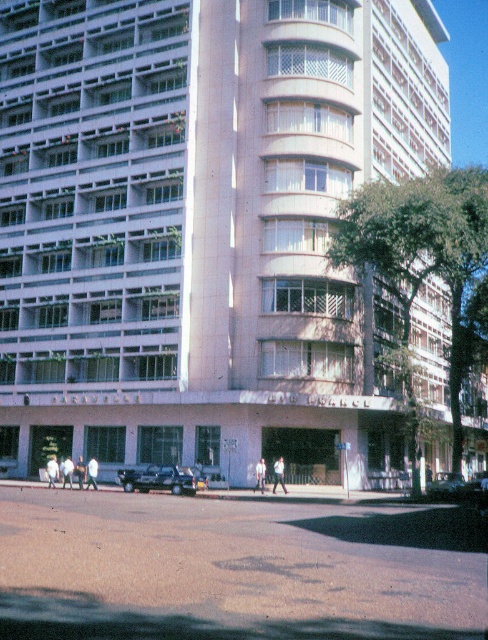
Question: Which point appears farthest from the camera in this image?

Choices:
 (A) (51, 468)
 (B) (153, 483)
 (C) (261, 480)
 (D) (87, 486)

Answer: (D)

Question: Can you confirm if light blue shirt at center is bigger than light brown leather jacket at lower left?

Choices:
 (A) yes
 (B) no

Answer: (B)

Question: In this image, where is white concrete building at center located relative to white matte person at lower left?

Choices:
 (A) above
 (B) below

Answer: (A)

Question: Based on their relative distances, which object is nearer to the light beige pants at lower left?

Choices:
 (A) white matte person at lower left
 (B) light brown leather jacket at lower left

Answer: (B)

Question: Does light beige pants at lower left come in front of white matte person at center?

Choices:
 (A) no
 (B) yes

Answer: (A)

Question: Which of the following is the farthest from the observer?

Choices:
 (A) white matte person at lower left
 (B) white concrete building at center
 (C) shiny silver sedan at center
 (D) metallic silver truck at center

Answer: (A)